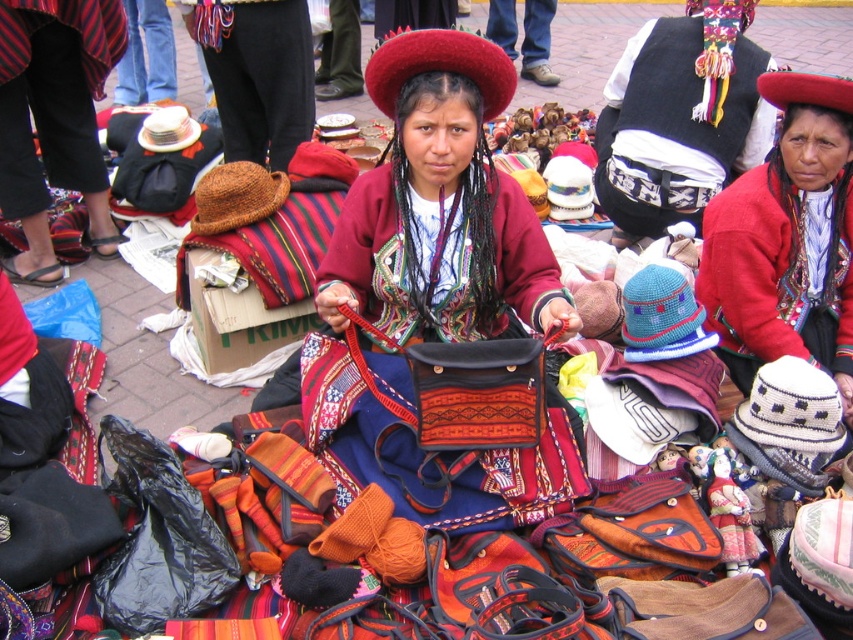
In the vibrant street market scene, you notice two items for sale from the vendor. The knitted wool hat at center and the black fabric pants at lower left. Which item takes up less space in terms of size?

The knitted wool hat at center is smaller than the black fabric pants at lower left, so it takes up less space.